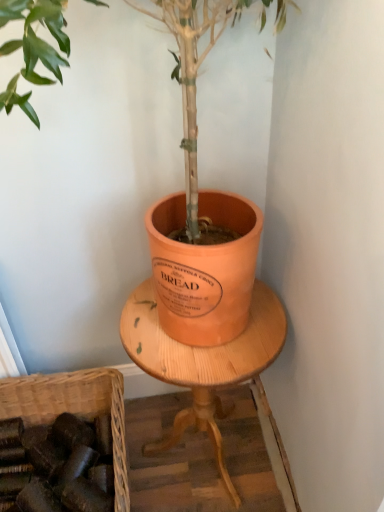
Question: Should I look upward or downward to see brown woven basket at lower left?

Choices:
 (A) down
 (B) up

Answer: (A)

Question: Can you confirm if brown woven basket at lower left is wider than wooden round table at center?

Choices:
 (A) no
 (B) yes

Answer: (B)

Question: Is brown woven basket at lower left aimed at wooden round table at center?

Choices:
 (A) no
 (B) yes

Answer: (A)

Question: From a real-world perspective, does brown woven basket at lower left sit lower than wooden round table at center?

Choices:
 (A) no
 (B) yes

Answer: (B)

Question: Is brown woven basket at lower left located outside wooden round table at center?

Choices:
 (A) no
 (B) yes

Answer: (B)

Question: Does brown woven basket at lower left have a smaller size compared to wooden round table at center?

Choices:
 (A) yes
 (B) no

Answer: (A)

Question: Is brown woven basket at lower left looking in the opposite direction of wooden round table at center?

Choices:
 (A) yes
 (B) no

Answer: (B)

Question: From a real-world perspective, is matte orange pot at center below brown woven basket at lower left?

Choices:
 (A) yes
 (B) no

Answer: (B)

Question: Is brown woven basket at lower left surrounded by matte orange pot at center?

Choices:
 (A) yes
 (B) no

Answer: (B)

Question: From the image's perspective, is matte orange pot at center over brown woven basket at lower left?

Choices:
 (A) yes
 (B) no

Answer: (A)

Question: Is matte orange pot at center far away from brown woven basket at lower left?

Choices:
 (A) no
 (B) yes

Answer: (A)

Question: Can you confirm if matte orange pot at center is positioned to the left of brown woven basket at lower left?

Choices:
 (A) no
 (B) yes

Answer: (A)

Question: Considering the relative sizes of matte orange pot at center and brown woven basket at lower left in the image provided, is matte orange pot at center bigger than brown woven basket at lower left?

Choices:
 (A) no
 (B) yes

Answer: (B)

Question: From a real-world perspective, is brown woven basket at lower left under matte orange pot at center?

Choices:
 (A) no
 (B) yes

Answer: (B)